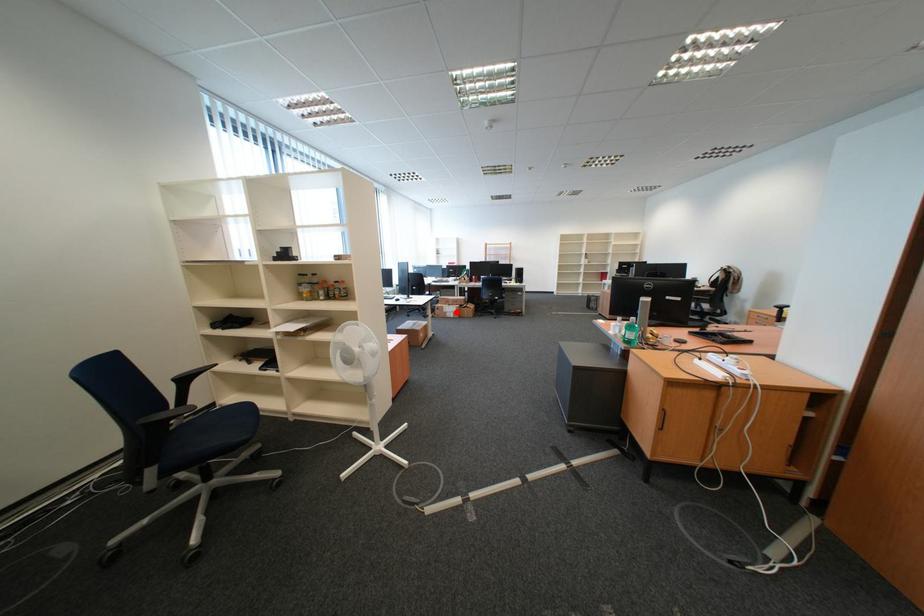
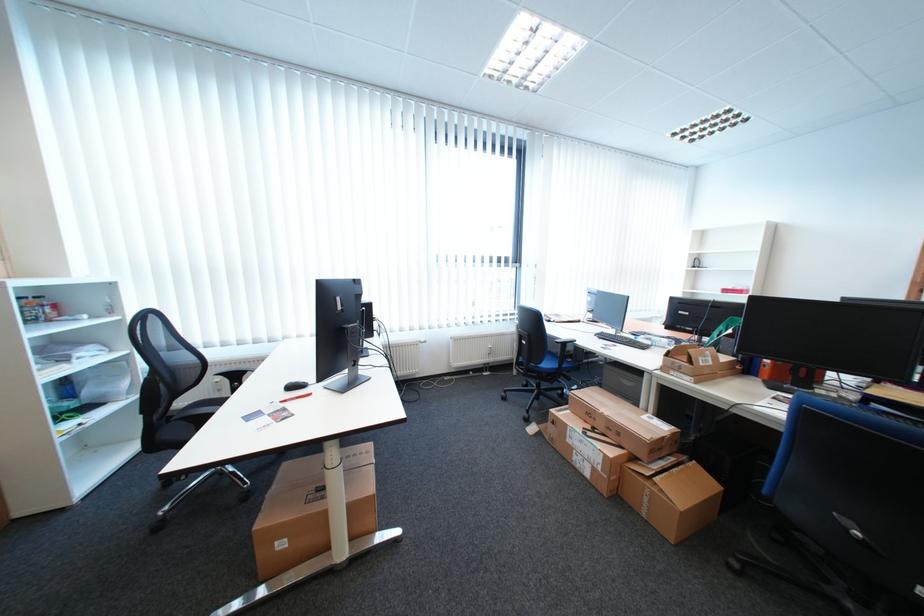
Question: I am providing you with two images of the same scene from different viewpoints. A red point is shown in image1. For the corresponding object point in image2, is it positioned nearer or farther from the camera?

Choices:
 (A) Nearer
 (B) Farther

Answer: (B)